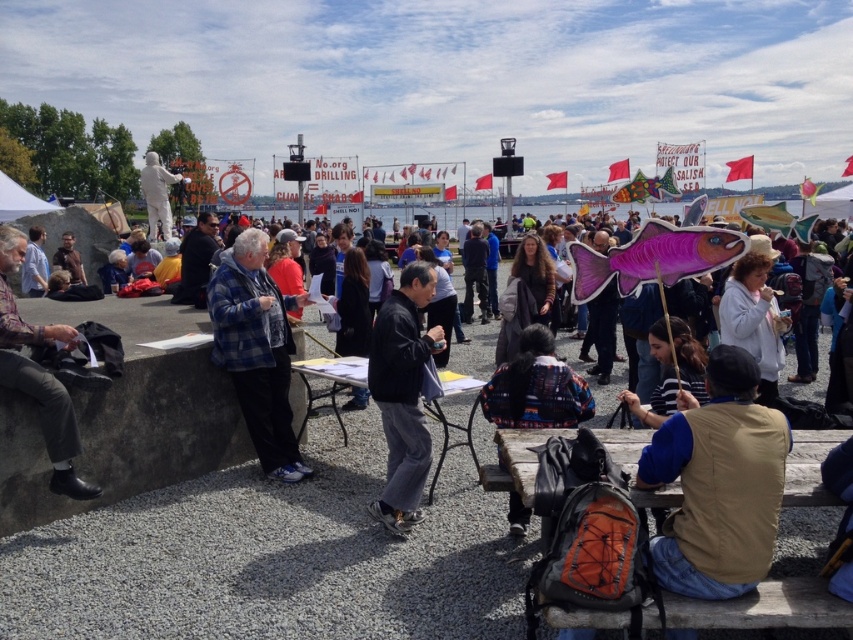
Question: Estimate the real-world distances between objects in this image. Which object is farther from the black leather jacket at center?

Choices:
 (A) blue plaid shirt at center
 (B) brown suede vest at lower right
 (C) dark gray pants at left

Answer: (B)

Question: Does blue plaid shirt at center come behind dark gray pants at left?

Choices:
 (A) yes
 (B) no

Answer: (A)

Question: Is blue plaid shirt at center above black leather jacket at center?

Choices:
 (A) no
 (B) yes

Answer: (B)

Question: Is blue plaid shirt at center thinner than black leather jacket at center?

Choices:
 (A) no
 (B) yes

Answer: (A)

Question: Considering the real-world distances, which object is farthest from the dark gray pants at left?

Choices:
 (A) black leather jacket at center
 (B) brown suede vest at lower right

Answer: (B)

Question: Which of these objects is positioned farthest from the dark gray pants at left?

Choices:
 (A) blue plaid shirt at center
 (B) black leather jacket at center

Answer: (B)